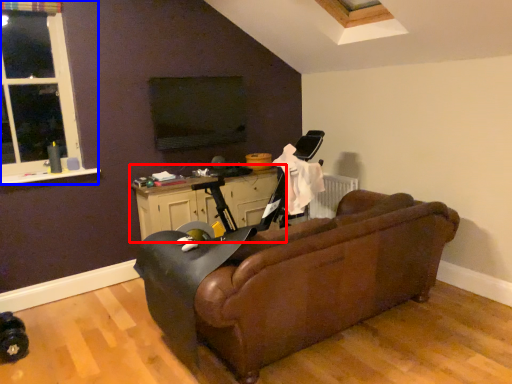
Question: Which object appears closest to the camera in this image, table (highlighted by a red box) or window (highlighted by a blue box)?

Choices:
 (A) table
 (B) window

Answer: (B)